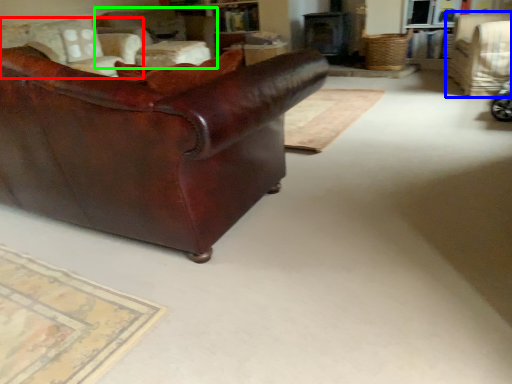
Question: Based on their relative distances, which object is nearer to chair (highlighted by a red box)? Choose from chair (highlighted by a blue box) and chair (highlighted by a green box).

Choices:
 (A) chair
 (B) chair

Answer: (B)